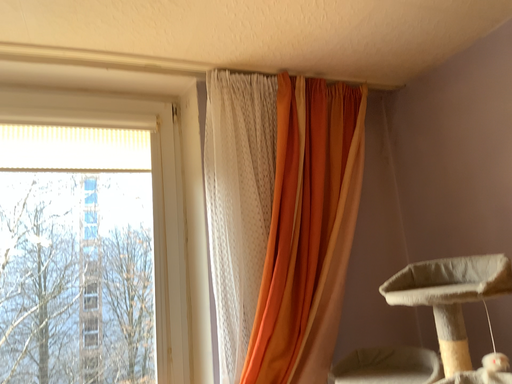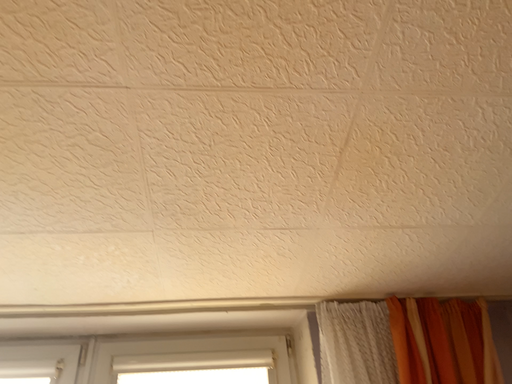
Question: How did the camera likely rotate when shooting the video?

Choices:
 (A) rotated right
 (B) rotated left

Answer: (B)